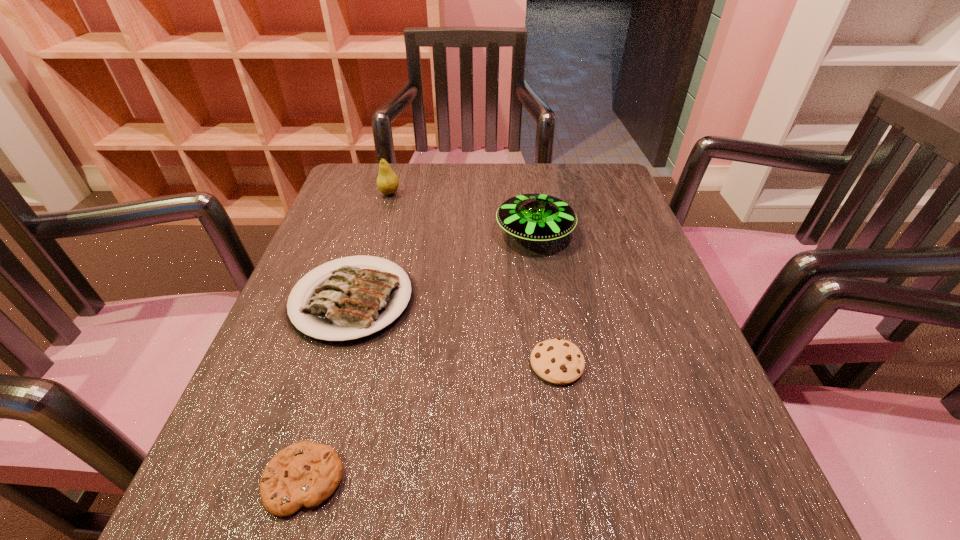
Locate an element on the screen. The image size is (960, 540). blank space that satisfies the following two spatial constraints: 1. on the front side of the nearest object; 2. on the left side of the plate is located at coordinates (298, 480).